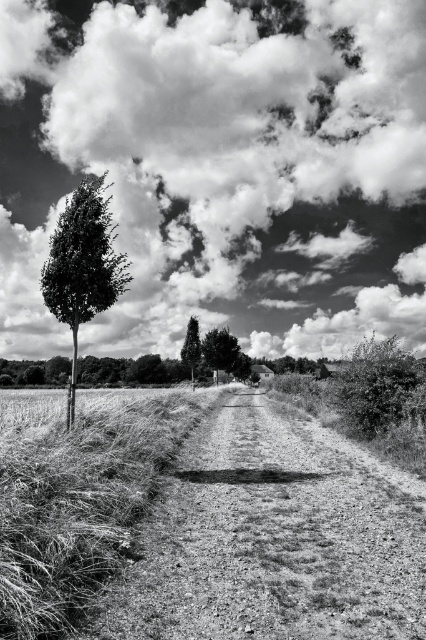
This screenshot has width=426, height=640. What do you see at coordinates (219, 349) in the screenshot?
I see `green leafy tree at center` at bounding box center [219, 349].

Which is behind, point (218, 356) or point (192, 349)?

The point (218, 356) is more distant.

Image resolution: width=426 pixels, height=640 pixels. Describe the element at coordinates (219, 349) in the screenshot. I see `green leafy tree at center` at that location.

The height and width of the screenshot is (640, 426). In order to click on green leafy tree at center in this screenshot , I will do `click(219, 349)`.

Can you confirm if fluffy cotton cloud at upper center is smaller than grassy field at left?

Incorrect, fluffy cotton cloud at upper center is not smaller in size than grassy field at left.

Is point (152, 262) closer to camera compared to point (149, 461)?

No.

Image resolution: width=426 pixels, height=640 pixels. I want to click on fluffy cotton cloud at upper center, so click(x=221, y=168).

Is point (152, 632) positioned before point (52, 250)?

Yes.

Which is below, dirt/gravel road at center or smooth green tree at left?

dirt/gravel road at center is below.

Is point (333, 500) in front of point (97, 310)?

Yes, it is.

This screenshot has width=426, height=640. Identify the location of dirt/gravel road at center. (275, 538).